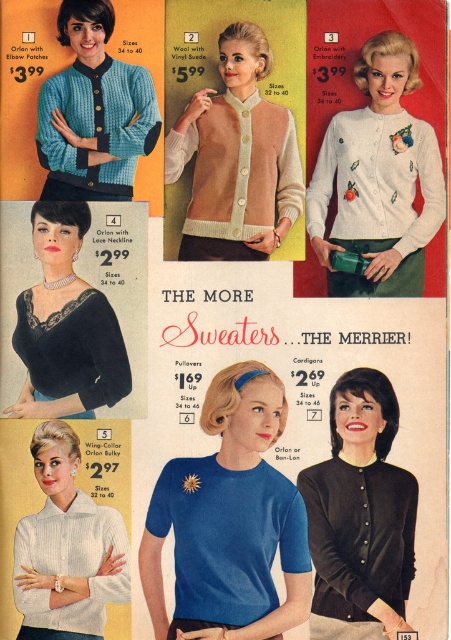
Question: Which object is positioned closest to the teal knit sweater at upper left?

Choices:
 (A) matte blue knit sweater at center
 (B) wool with vinyl suede at center
 (C) white embroidered cardigan at upper right

Answer: (B)

Question: Can you confirm if black matte cardigan at center is smaller than velvet black blouse at lower left?

Choices:
 (A) no
 (B) yes

Answer: (A)

Question: Which object is positioned farthest from the teal knit sweater at upper left?

Choices:
 (A) matte blue knit sweater at center
 (B) velvet black blouse at lower left
 (C) white knit sweater at lower left

Answer: (C)

Question: Is teal knit sweater at upper left above white knit sweater at lower left?

Choices:
 (A) no
 (B) yes

Answer: (B)

Question: Is matte blue knit sweater at center smaller than wool with vinyl suede at center?

Choices:
 (A) no
 (B) yes

Answer: (A)

Question: Which object appears farthest from the camera in this image?

Choices:
 (A) white embroidered cardigan at upper right
 (B) teal knit sweater at upper left

Answer: (A)